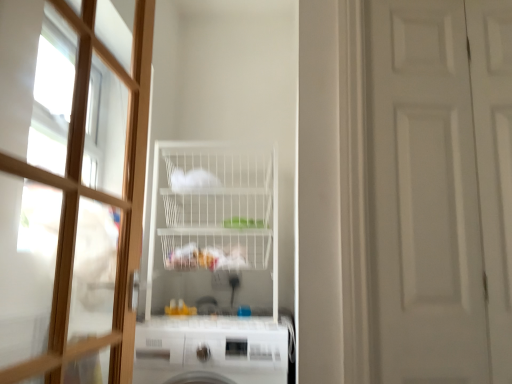
Question: Is there a large distance between wooden door at left, the first door from the left, and white matte door at right, which is counted as the 1th door, starting from the right?

Choices:
 (A) no
 (B) yes

Answer: (A)

Question: Does wooden door at left, the first door from the left, have a larger size compared to white matte door at right, placed as the second door when sorted from left to right?

Choices:
 (A) yes
 (B) no

Answer: (A)

Question: From the image's perspective, does wooden door at left, the first door from the left, appear higher than white matte door at right, placed as the second door when sorted from left to right?

Choices:
 (A) yes
 (B) no

Answer: (A)

Question: Does wooden door at left, the first door from the left, have a smaller size compared to white matte door at right, which is counted as the 1th door, starting from the right?

Choices:
 (A) yes
 (B) no

Answer: (B)

Question: Is wooden door at left, which appears as the 2th door when viewed from the right, further to camera compared to white matte door at right, which is counted as the 1th door, starting from the right?

Choices:
 (A) no
 (B) yes

Answer: (A)

Question: Is white matte door at right, which is counted as the 1th door, starting from the right, completely or partially inside wooden door at left, which appears as the 2th door when viewed from the right?

Choices:
 (A) no
 (B) yes

Answer: (A)

Question: Is wooden door at left, which appears as the 2th door when viewed from the right, at the left side of white glossy dishwasher at lower center?

Choices:
 (A) yes
 (B) no

Answer: (A)

Question: Does wooden door at left, the first door from the left, lie in front of white glossy dishwasher at lower center?

Choices:
 (A) yes
 (B) no

Answer: (A)

Question: Is wooden door at left, which appears as the 2th door when viewed from the right, far from white glossy dishwasher at lower center?

Choices:
 (A) no
 (B) yes

Answer: (A)

Question: Can you confirm if wooden door at left, which appears as the 2th door when viewed from the right, is positioned to the right of white glossy dishwasher at lower center?

Choices:
 (A) yes
 (B) no

Answer: (B)

Question: Is wooden door at left, which appears as the 2th door when viewed from the right, oriented towards white glossy dishwasher at lower center?

Choices:
 (A) yes
 (B) no

Answer: (B)

Question: From a real-world perspective, is wooden door at left, the first door from the left, beneath white glossy dishwasher at lower center?

Choices:
 (A) no
 (B) yes

Answer: (A)

Question: Can you confirm if white wire shelf at center is positioned to the left of wooden door at left, the first door from the left?

Choices:
 (A) no
 (B) yes

Answer: (A)